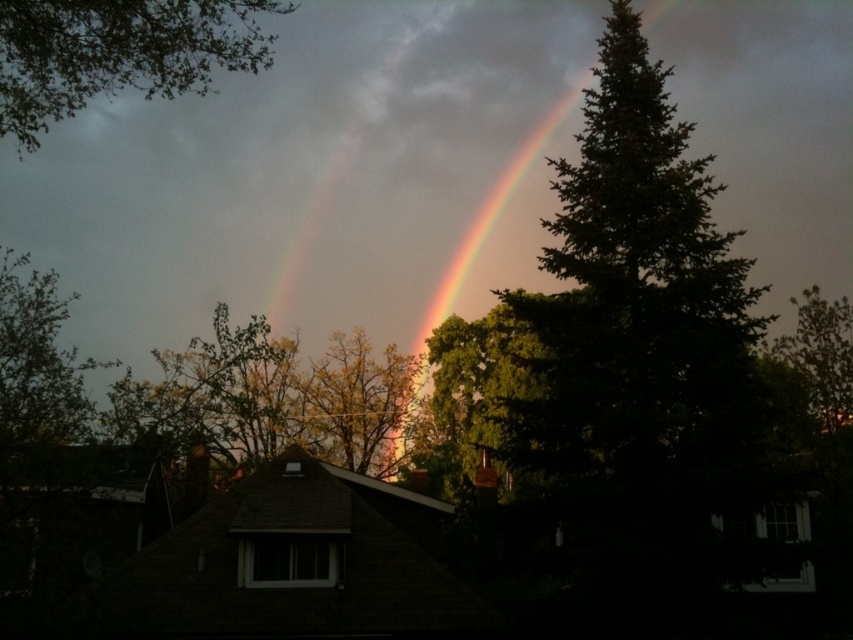
You are standing in the outdoor scene and want to walk from the point at coordinates point (498, 202) to the point at coordinates point (843, 344). Which direction should you face to move towards the second point?

Since point (498, 202) is closer to you than point (843, 344), you should face away from the foreground towards the background to move towards the second point.

You are a park ranger planning to install a bench between the green leafy tree at upper left and the green leafy tree at right. If the bench requires a minimum of 3 meters of space between the trees to fit comfortably, will there be enough space?

The distance between the green leafy tree at upper left and the green leafy tree at right is 43.87 meters, which is more than the required 3 meters. Therefore, there is sufficient space to install the bench comfortably.